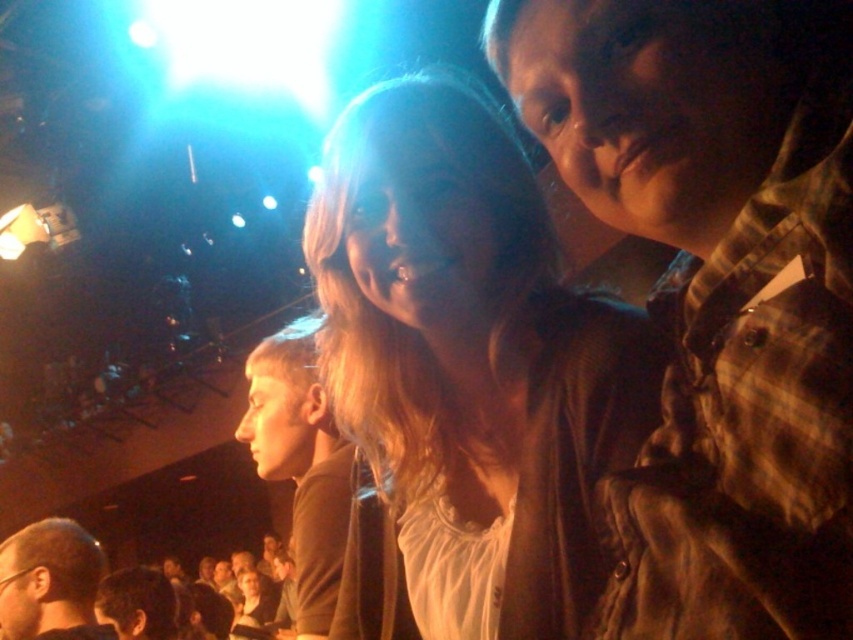
Question: Can you confirm if brown plaid shirt at upper right is bigger than light brown hair at lower left?

Choices:
 (A) yes
 (B) no

Answer: (B)

Question: Which object is closer to the camera taking this photo?

Choices:
 (A) brown matte shirt at center
 (B) brown plaid shirt at upper right
 (C) light brown hair at lower left

Answer: (B)

Question: Which object is positioned closest to the brown plaid shirt at upper right?

Choices:
 (A) light brown hair at lower left
 (B) brown matte shirt at center

Answer: (B)

Question: Where is brown plaid shirt at upper right located in relation to light brown hair at center in the image?

Choices:
 (A) below
 (B) above

Answer: (B)

Question: Is brown plaid shirt at upper right wider than light brown hair at lower left?

Choices:
 (A) yes
 (B) no

Answer: (B)

Question: Which point appears farthest from the camera in this image?

Choices:
 (A) (16, 589)
 (B) (321, 632)

Answer: (A)